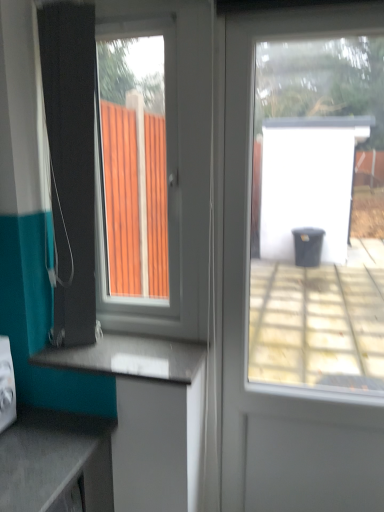
Question: Does smooth gray countertop at lower center have a smaller size compared to transparent glass door at center?

Choices:
 (A) yes
 (B) no

Answer: (A)

Question: Does smooth gray countertop at lower center have a larger size compared to transparent glass door at center?

Choices:
 (A) no
 (B) yes

Answer: (A)

Question: Does smooth gray countertop at lower center touch transparent glass door at center?

Choices:
 (A) no
 (B) yes

Answer: (A)

Question: From the image's perspective, is smooth gray countertop at lower center located above transparent glass door at center?

Choices:
 (A) yes
 (B) no

Answer: (B)

Question: From a real-world perspective, is smooth gray countertop at lower center below transparent glass door at center?

Choices:
 (A) yes
 (B) no

Answer: (A)

Question: Can transparent glass door at center be found inside smooth gray countertop at lower center?

Choices:
 (A) yes
 (B) no

Answer: (B)

Question: Is smooth gray countertop at lower center surrounded by teal fabric shower curtain at left?

Choices:
 (A) yes
 (B) no

Answer: (B)

Question: Can you confirm if teal fabric shower curtain at left is bigger than smooth gray countertop at lower center?

Choices:
 (A) yes
 (B) no

Answer: (A)

Question: Is teal fabric shower curtain at left smaller than smooth gray countertop at lower center?

Choices:
 (A) no
 (B) yes

Answer: (A)

Question: Is teal fabric shower curtain at left further to camera compared to smooth gray countertop at lower center?

Choices:
 (A) yes
 (B) no

Answer: (B)

Question: Is there a large distance between teal fabric shower curtain at left and smooth gray countertop at lower center?

Choices:
 (A) yes
 (B) no

Answer: (B)

Question: Is teal fabric shower curtain at left positioned with its back to smooth gray countertop at lower center?

Choices:
 (A) yes
 (B) no

Answer: (B)

Question: Is smooth gray countertop at lower center facing away from teal fabric shower curtain at left?

Choices:
 (A) yes
 (B) no

Answer: (B)